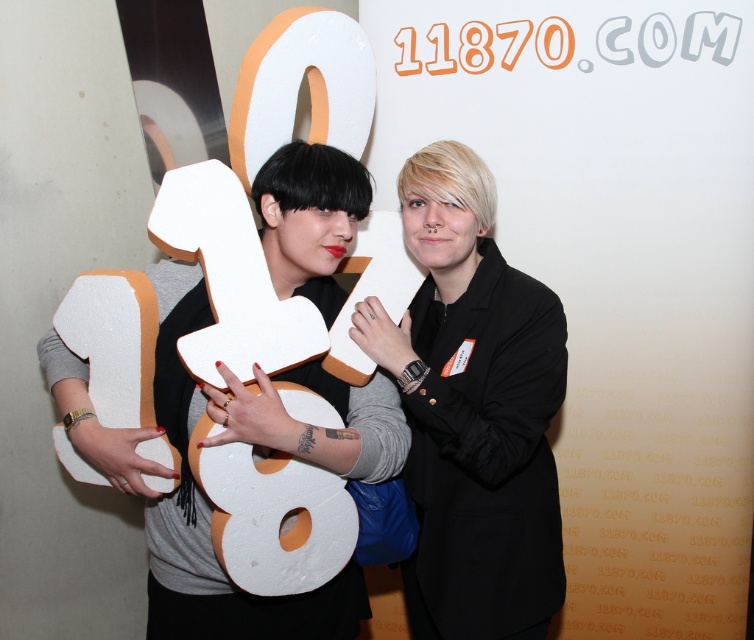
You are a photographer taking a picture of the black matte jacket at center and the white foam number at center. Which object will appear larger in the photo?

The white foam number at center will appear larger in the photo because it is larger than the black matte jacket at center.

Looking at this image, you are a photographer standing 3 meters away from the black matte jacket at center and the white foam number at center. You want to take a photo where the two objects are clearly visible without any overlap. Given that your camera has a minimum focus distance of 2 meters, can you capture both objects in focus without moving closer?

The black matte jacket at center is 27.02 centimeters away from the white foam number at center. Since both objects are within 3 meters and your camera can focus as close as 2 meters, you can capture both objects in focus without moving closer.